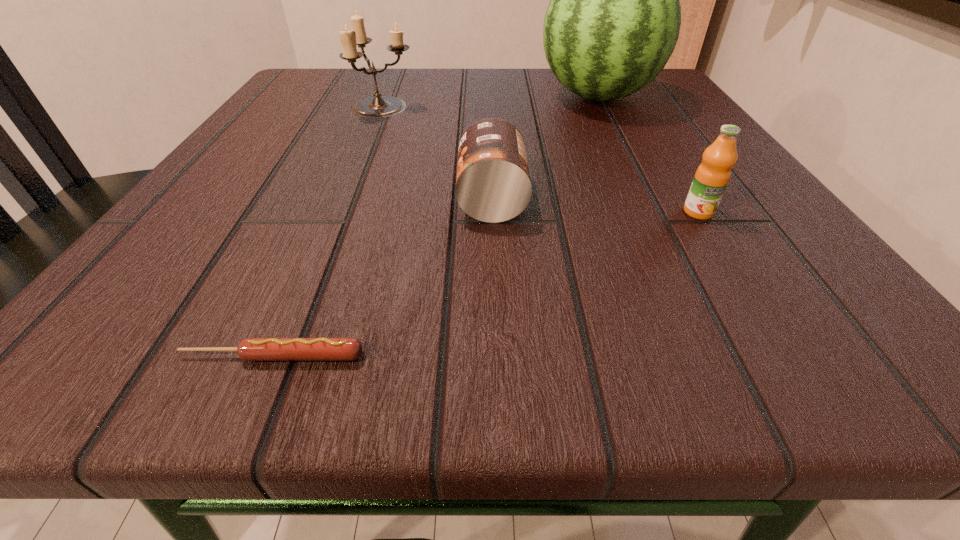
Locate an element on the screen. The image size is (960, 540). free space located 0.230m on the front label of the can is located at coordinates (282, 198).

Where is `free space located on the front label of the can`? free space located on the front label of the can is located at coordinates (397, 198).

Locate an element on the screen. The width and height of the screenshot is (960, 540). vacant position located 0.280m on the front label of the can is located at coordinates click(x=244, y=198).

Identify the location of blank area located 0.330m on the back of the shortest object. (353, 165).

Locate an element on the screen. Image resolution: width=960 pixels, height=540 pixels. watermelon located at the far edge is located at coordinates (613, 21).

This screenshot has width=960, height=540. Identify the location of candle holder present at the far edge. (379, 106).

Image resolution: width=960 pixels, height=540 pixels. I want to click on object that is at the near edge, so click(250, 349).

Where is `candle holder present at the left edge`? The width and height of the screenshot is (960, 540). candle holder present at the left edge is located at coordinates (379, 106).

Where is `sausage located in the left edge section of the desktop`? sausage located in the left edge section of the desktop is located at coordinates (250, 349).

Locate an element on the screen. watermelon that is at the right edge is located at coordinates (613, 21).